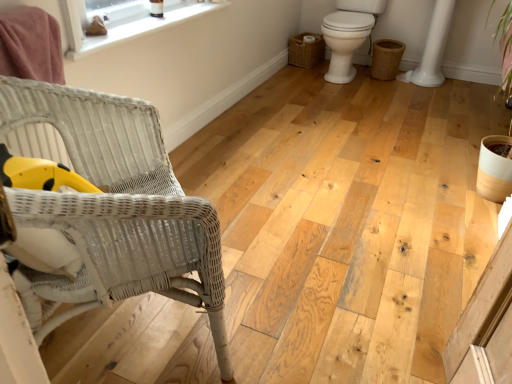
Where is `free point in front of braided wicker basket at lower right, the second basket when ordered from left to right`? The height and width of the screenshot is (384, 512). free point in front of braided wicker basket at lower right, the second basket when ordered from left to right is located at coordinates (391, 89).